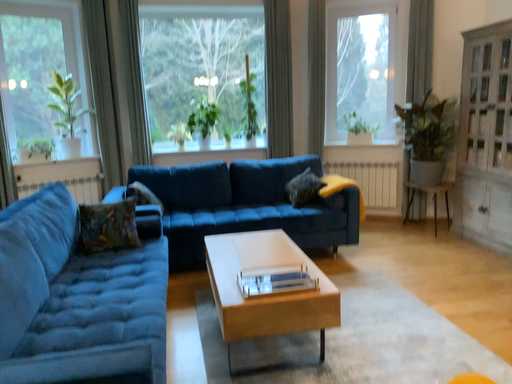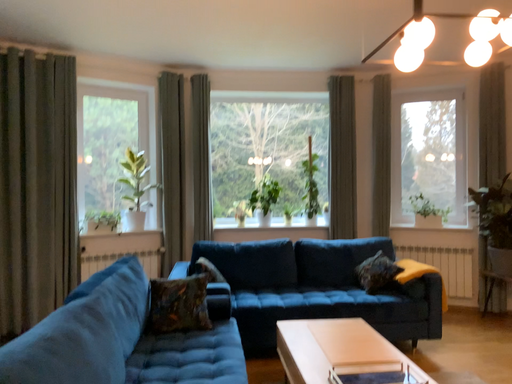
Question: How did the camera likely rotate when shooting the video?

Choices:
 (A) rotated downward
 (B) rotated upward

Answer: (B)